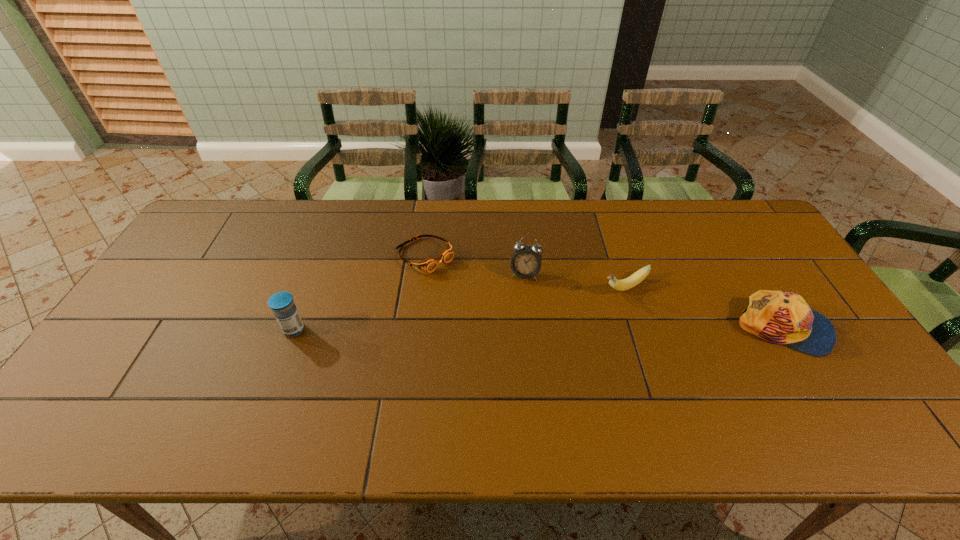
Where is `vacant region between the rightmost object and the alarm clock`? vacant region between the rightmost object and the alarm clock is located at coordinates (655, 301).

Where is `free space between the third object from right to left and the second object from left to right`? free space between the third object from right to left and the second object from left to right is located at coordinates (475, 265).

Where is `empty space between the shortest object and the leftmost object`? This screenshot has width=960, height=540. empty space between the shortest object and the leftmost object is located at coordinates (359, 293).

Where is `vacant region between the shortest object and the rightmost object`? vacant region between the shortest object and the rightmost object is located at coordinates (604, 292).

Identify which object is the second nearest to the cap. Please provide its 2D coordinates. Your answer should be formatted as a tuple, i.e. [(x, y)], where the tuple contains the x and y coordinates of a point satisfying the conditions above.

[(526, 261)]

The height and width of the screenshot is (540, 960). Find the location of `the third closest object to the banana`. the third closest object to the banana is located at coordinates (428, 265).

Locate an element on the screen. This screenshot has width=960, height=540. free space that satisfies the following two spatial constraints: 1. on the front side of the shortest object; 2. on the bill of the cap is located at coordinates (415, 328).